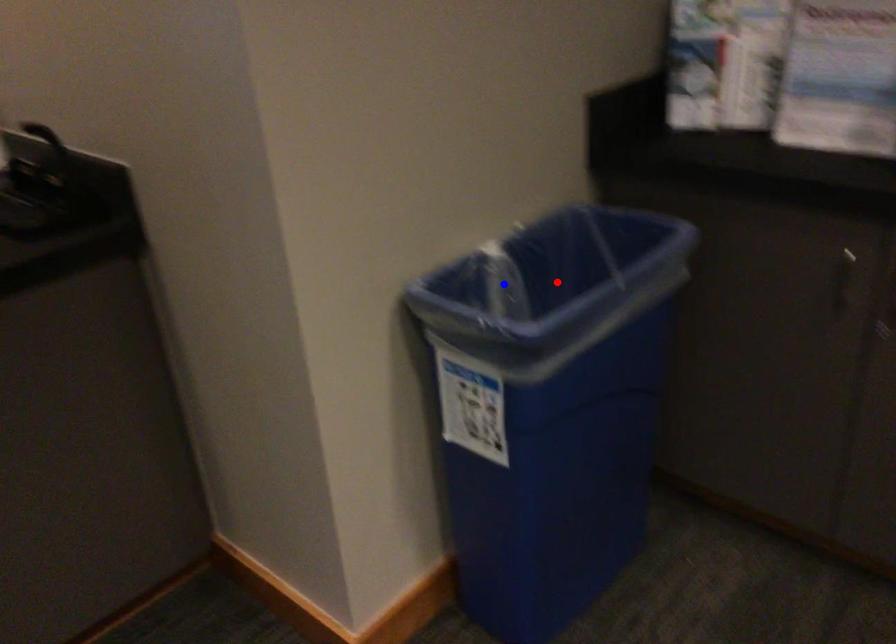
Question: Which of the two points in the image is closer to the camera?

Choices:
 (A) Blue point is closer.
 (B) Red point is closer.

Answer: (B)